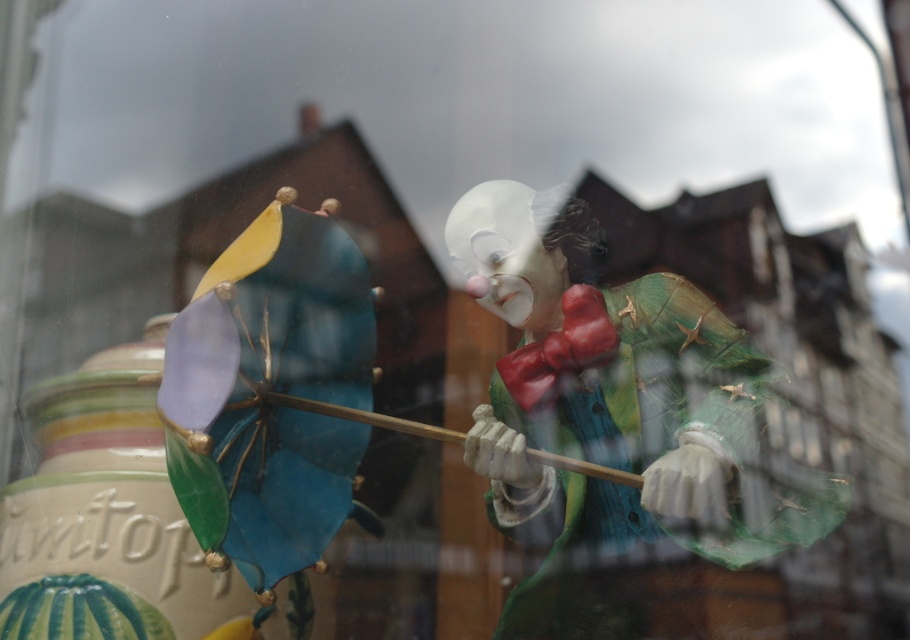
You are a customer in a store looking at the window display. You see the matte porcelain clown at center and the matte white clown nose at center. Which one do you think is bigger?

The matte porcelain clown at center is larger in size than the matte white clown nose at center, so the matte porcelain clown at center is bigger.

You are a photographer standing at a certain position and want to take a close up photo of the matte porcelain clown at center. The camera you are using has a minimum focusing distance of 3 feet. Can you take the photo without moving closer?

The matte porcelain clown at center and camera are 3.35 feet apart, so yes, the photographer can take the photo without moving closer since the distance is within the camera minimum focusing distance of 3 feet.